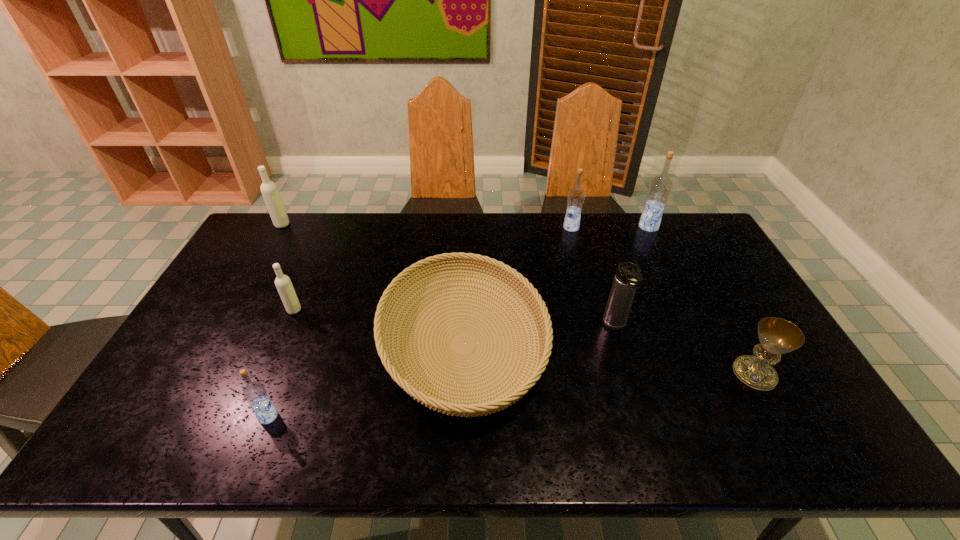
You are a GUI agent. You are given a task and a screenshot of the screen. Output one action in this format:
    pyautogui.click(x=<x>, y=<y>)
    Task: Click on the leftmost blue vodka
    The image size is (960, 540).
    Given the screenshot: What is the action you would take?
    pyautogui.click(x=254, y=392)

Find the location of `the rightmost object`. the rightmost object is located at coordinates (777, 336).

At what (x,y) coordinates should I click in order to perform the action: click on beige basket. Please return your answer as a coordinate pair (x, y). This screenshot has height=540, width=960. Looking at the image, I should click on (502, 398).

Find the location of a particular element. basket is located at coordinates (502, 398).

Locate an element on the screen. The width and height of the screenshot is (960, 540). vacant region located 0.230m on the front of the tallest object is located at coordinates (672, 275).

This screenshot has height=540, width=960. I want to click on free space located on the front of the farther white vodka, so click(x=261, y=260).

The image size is (960, 540). I want to click on vacant space located 0.210m on the front of the fourth vodka from left to right, so click(582, 270).

Identify the location of vacant area situated 0.320m on the handle side of the thermos bottle. (652, 450).

Where is `blank space located 0.210m on the front of the seventh object from right to left`? Image resolution: width=960 pixels, height=540 pixels. blank space located 0.210m on the front of the seventh object from right to left is located at coordinates (266, 374).

The height and width of the screenshot is (540, 960). What are the coordinates of `vacant space located on the right of the smallest blue vodka` in the screenshot? It's located at (336, 416).